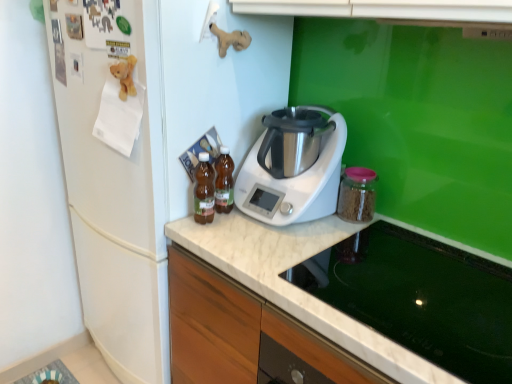
The height and width of the screenshot is (384, 512). In order to click on glass stovetop at lower center in this screenshot , I will do `click(421, 298)`.

This screenshot has width=512, height=384. What do you see at coordinates (153, 157) in the screenshot?
I see `white matte refrigerator at left` at bounding box center [153, 157].

This screenshot has width=512, height=384. What do you see at coordinates (204, 190) in the screenshot?
I see `brown glass bottles at center, which is the 1th kitchen appliance in left-to-right order` at bounding box center [204, 190].

Image resolution: width=512 pixels, height=384 pixels. What are the coordinates of `glass stovetop at lower center` in the screenshot? It's located at (421, 298).

Considering the relative positions of glass stovetop at lower center and white plastic appliance at center, which is counted as the 2th kitchen appliance, starting from the right, in the image provided, is glass stovetop at lower center to the right of white plastic appliance at center, which is counted as the 2th kitchen appliance, starting from the right, from the viewer's perspective?

Indeed, glass stovetop at lower center is positioned on the right side of white plastic appliance at center, which is counted as the 2th kitchen appliance, starting from the right.

Who is shorter, glass stovetop at lower center or white plastic appliance at center, which is the third kitchen appliance in left-to-right order?

With less height is glass stovetop at lower center.

Is glass stovetop at lower center bigger than white plastic appliance at center, which is the third kitchen appliance in left-to-right order?

Yes, glass stovetop at lower center is bigger than white plastic appliance at center, which is the third kitchen appliance in left-to-right order.

Are glass stovetop at lower center and white plastic appliance at center, which is the third kitchen appliance in left-to-right order, far apart?

No, glass stovetop at lower center is not far from white plastic appliance at center, which is the third kitchen appliance in left-to-right order.

Do you think transparent glass jar at right, which is the first kitchen appliance in right-to-left order, is within brown glass bottles at center, arranged as the 4th kitchen appliance when viewed from the right, or outside of it?

The correct answer is: outside.

How much distance is there between transparent glass jar at right, the 4th kitchen appliance in the left-to-right sequence, and brown glass bottles at center, which is the 1th kitchen appliance in left-to-right order?

A distance of 18.28 inches exists between transparent glass jar at right, the 4th kitchen appliance in the left-to-right sequence, and brown glass bottles at center, which is the 1th kitchen appliance in left-to-right order.

Considering the points (346, 178) and (211, 197), which point is in front, point (346, 178) or point (211, 197)?

The point (211, 197) is closer.

Does transparent glass jar at right, which is the first kitchen appliance in right-to-left order, have a greater width compared to brown glass bottles at center, which is the 1th kitchen appliance in left-to-right order?

Yes.

Looking at this image, from the image's perspective, is white matte refrigerator at left under brown glass bottles at center, arranged as the 4th kitchen appliance when viewed from the right?

Yes, from the image's perspective, white matte refrigerator at left is beneath brown glass bottles at center, arranged as the 4th kitchen appliance when viewed from the right.

Which object is positioned more to the left, white matte refrigerator at left or brown glass bottles at center, arranged as the 4th kitchen appliance when viewed from the right?

white matte refrigerator at left.

Considering the points (161, 379) and (207, 214), which point is behind, point (161, 379) or point (207, 214)?

The point (161, 379) is farther from the camera.

Considering the sizes of objects white matte refrigerator at left and brown glass bottles at center, arranged as the 4th kitchen appliance when viewed from the right, in the image provided, who is taller, white matte refrigerator at left or brown glass bottles at center, arranged as the 4th kitchen appliance when viewed from the right,?

With more height is white matte refrigerator at left.

Considering the sizes of objects translucent glass bottles at center, placed as the 3th kitchen appliance when sorted from right to left, and white plastic appliance at center, which is counted as the 2th kitchen appliance, starting from the right, in the image provided, who is wider, translucent glass bottles at center, placed as the 3th kitchen appliance when sorted from right to left, or white plastic appliance at center, which is counted as the 2th kitchen appliance, starting from the right,?

Wider between the two is white plastic appliance at center, which is counted as the 2th kitchen appliance, starting from the right.

Is translucent glass bottles at center, placed as the 3th kitchen appliance when sorted from right to left, located outside white plastic appliance at center, which is the third kitchen appliance in left-to-right order?

Actually, translucent glass bottles at center, placed as the 3th kitchen appliance when sorted from right to left, is at least partially inside white plastic appliance at center, which is the third kitchen appliance in left-to-right order.

Could you tell me if translucent glass bottles at center, placed as the 3th kitchen appliance when sorted from right to left, is turned towards white plastic appliance at center, which is counted as the 2th kitchen appliance, starting from the right?

No, translucent glass bottles at center, placed as the 3th kitchen appliance when sorted from right to left, is not turned towards white plastic appliance at center, which is counted as the 2th kitchen appliance, starting from the right.

Consider the image. From a real-world perspective, between translucent glass bottles at center, acting as the 2th kitchen appliance starting from the left, and white plastic appliance at center, which is counted as the 2th kitchen appliance, starting from the right, who is vertically higher?

white plastic appliance at center, which is counted as the 2th kitchen appliance, starting from the right, is physically above.

From a real-world perspective, which object rests below the other?

white matte refrigerator at left, from a real-world perspective.

Is point (153, 113) closer to camera compared to point (340, 198)?

Yes, it is in front of point (340, 198).

From the image's perspective, which one is positioned lower, white matte refrigerator at left or transparent glass jar at right, the 4th kitchen appliance in the left-to-right sequence?

From the image's view, white matte refrigerator at left is below.

Do you think translucent glass bottles at center, acting as the 2th kitchen appliance starting from the left, is within brown glass bottles at center, arranged as the 4th kitchen appliance when viewed from the right, or outside of it?

The correct answer is: outside.

From the picture: Is translucent glass bottles at center, placed as the 3th kitchen appliance when sorted from right to left, positioned behind brown glass bottles at center, which is the 1th kitchen appliance in left-to-right order?

That is True.

From the image's perspective, which is below, translucent glass bottles at center, placed as the 3th kitchen appliance when sorted from right to left, or brown glass bottles at center, arranged as the 4th kitchen appliance when viewed from the right?

brown glass bottles at center, arranged as the 4th kitchen appliance when viewed from the right, from the image's perspective.

Visually, is translucent glass bottles at center, acting as the 2th kitchen appliance starting from the left, positioned to the left or to the right of brown glass bottles at center, arranged as the 4th kitchen appliance when viewed from the right?

From the image, it's evident that translucent glass bottles at center, acting as the 2th kitchen appliance starting from the left, is to the right of brown glass bottles at center, arranged as the 4th kitchen appliance when viewed from the right.

From a real-world perspective, who is located higher, brown glass bottles at center, which is the 1th kitchen appliance in left-to-right order, or transparent glass jar at right, which is the first kitchen appliance in right-to-left order?

brown glass bottles at center, which is the 1th kitchen appliance in left-to-right order, from a real-world perspective.

Is brown glass bottles at center, arranged as the 4th kitchen appliance when viewed from the right, not within transparent glass jar at right, which is the first kitchen appliance in right-to-left order?

brown glass bottles at center, arranged as the 4th kitchen appliance when viewed from the right, is positioned outside transparent glass jar at right, which is the first kitchen appliance in right-to-left order.

Is brown glass bottles at center, which is the 1th kitchen appliance in left-to-right order, positioned behind transparent glass jar at right, which is the first kitchen appliance in right-to-left order?

No, it is in front of transparent glass jar at right, which is the first kitchen appliance in right-to-left order.

From a real-world perspective, count 4th kitchen appliances upward from the glass stovetop at lower center and point to it. Please provide its 2D coordinates.

[(293, 167)]

Where is `kitchen appliance below the brown glass bottles at center, which is the 1th kitchen appliance in left-to-right order (from the image's perspective)`? This screenshot has width=512, height=384. kitchen appliance below the brown glass bottles at center, which is the 1th kitchen appliance in left-to-right order (from the image's perspective) is located at coordinates (357, 195).

Estimate the real-world distances between objects in this image. Which object is further from white plastic appliance at center, which is counted as the 2th kitchen appliance, starting from the right, brown glass bottles at center, arranged as the 4th kitchen appliance when viewed from the right, or glass stovetop at lower center?

glass stovetop at lower center is positioned further to the anchor white plastic appliance at center, which is counted as the 2th kitchen appliance, starting from the right.

Considering their positions, is transparent glass jar at right, which is the first kitchen appliance in right-to-left order, positioned further to glass stovetop at lower center than white matte refrigerator at left?

white matte refrigerator at left is further to glass stovetop at lower center.

Estimate the real-world distances between objects in this image. Which object is closer to white plastic appliance at center, which is counted as the 2th kitchen appliance, starting from the right, white matte refrigerator at left or transparent glass jar at right, the 4th kitchen appliance in the left-to-right sequence?

transparent glass jar at right, the 4th kitchen appliance in the left-to-right sequence, is closer to white plastic appliance at center, which is counted as the 2th kitchen appliance, starting from the right.

Which object lies further to the anchor point white matte refrigerator at left, glass stovetop at lower center or transparent glass jar at right, the 4th kitchen appliance in the left-to-right sequence?

glass stovetop at lower center is further to white matte refrigerator at left.

Considering their positions, is transparent glass jar at right, which is the first kitchen appliance in right-to-left order, positioned further to white matte refrigerator at left than brown glass bottles at center, which is the 1th kitchen appliance in left-to-right order?

Based on the image, transparent glass jar at right, which is the first kitchen appliance in right-to-left order, appears to be further to white matte refrigerator at left.

Which object lies further to the anchor point transparent glass jar at right, which is the first kitchen appliance in right-to-left order, glass stovetop at lower center or white plastic appliance at center, which is the third kitchen appliance in left-to-right order?

glass stovetop at lower center is positioned further to the anchor transparent glass jar at right, which is the first kitchen appliance in right-to-left order.

When comparing their distances from brown glass bottles at center, arranged as the 4th kitchen appliance when viewed from the right, does translucent glass bottles at center, placed as the 3th kitchen appliance when sorted from right to left, or transparent glass jar at right, the 4th kitchen appliance in the left-to-right sequence, seem further?

The object further to brown glass bottles at center, arranged as the 4th kitchen appliance when viewed from the right, is transparent glass jar at right, the 4th kitchen appliance in the left-to-right sequence.

Estimate the real-world distances between objects in this image. Which object is further from glass stovetop at lower center, translucent glass bottles at center, acting as the 2th kitchen appliance starting from the left, or transparent glass jar at right, the 4th kitchen appliance in the left-to-right sequence?

Based on the image, translucent glass bottles at center, acting as the 2th kitchen appliance starting from the left, appears to be further to glass stovetop at lower center.

I want to click on kitchen appliance between translucent glass bottles at center, acting as the 2th kitchen appliance starting from the left, and transparent glass jar at right, which is the first kitchen appliance in right-to-left order, so click(x=293, y=167).

This screenshot has height=384, width=512. Find the location of `kitchen appliance between brown glass bottles at center, which is the 1th kitchen appliance in left-to-right order, and white plastic appliance at center, which is the third kitchen appliance in left-to-right order, in the horizontal direction`. kitchen appliance between brown glass bottles at center, which is the 1th kitchen appliance in left-to-right order, and white plastic appliance at center, which is the third kitchen appliance in left-to-right order, in the horizontal direction is located at coordinates (224, 182).